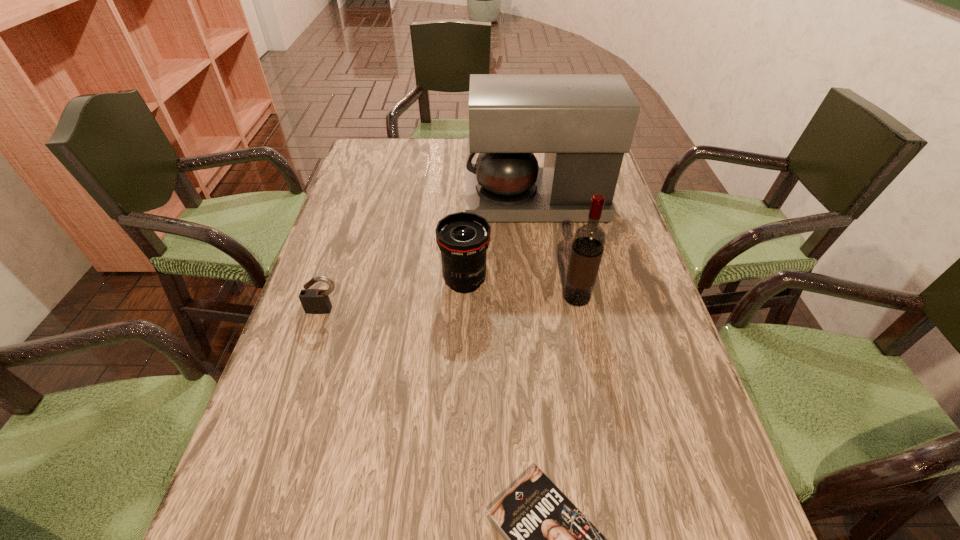
This screenshot has height=540, width=960. I want to click on coffee maker, so click(x=584, y=123).

Find the location of a particular element. The height and width of the screenshot is (540, 960). the tallest object is located at coordinates (584, 123).

At what (x,y) coordinates should I click in order to perform the action: click on the second tallest object. Please return your answer as a coordinate pair (x, y). Image resolution: width=960 pixels, height=540 pixels. Looking at the image, I should click on (589, 239).

Find the location of a particular element. The image size is (960, 540). the third shortest object is located at coordinates (463, 238).

Find the location of a particular element. The image size is (960, 540). the leftmost object is located at coordinates (314, 301).

The width and height of the screenshot is (960, 540). I want to click on padlock, so click(314, 301).

The width and height of the screenshot is (960, 540). What are the coordinates of `vacant space located on the carafe side of the farthest object` in the screenshot? It's located at (378, 202).

This screenshot has height=540, width=960. What are the coordinates of `vacant space situated 0.220m on the carafe side of the farthest object` in the screenshot? It's located at (392, 202).

Image resolution: width=960 pixels, height=540 pixels. I want to click on free space located 0.320m on the carafe side of the farthest object, so click(357, 202).

Identify the location of free point located 0.140m on the back of the second tallest object. (566, 248).